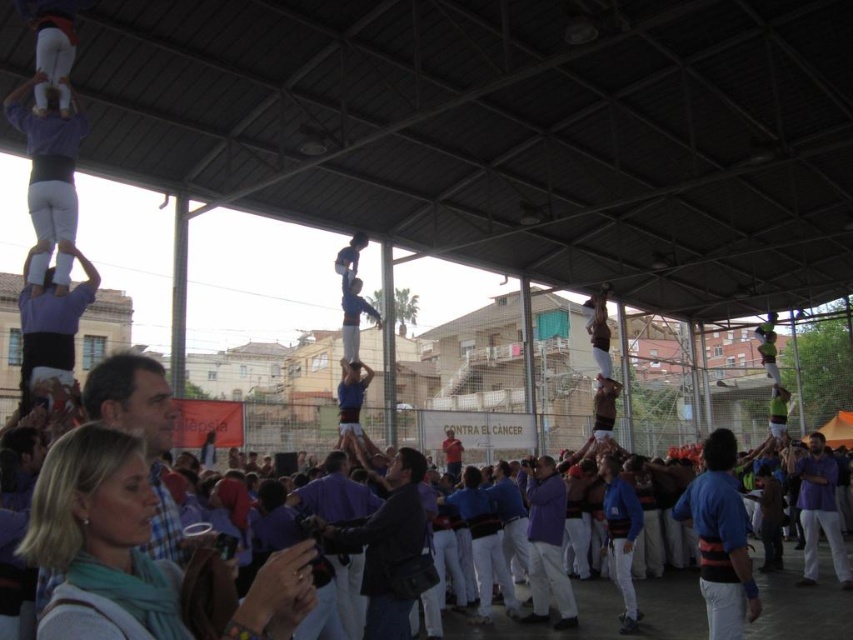
The width and height of the screenshot is (853, 640). What do you see at coordinates (48, 180) in the screenshot?
I see `matte white pants at upper left` at bounding box center [48, 180].

The image size is (853, 640). I want to click on matte white pants at upper left, so tap(48, 180).